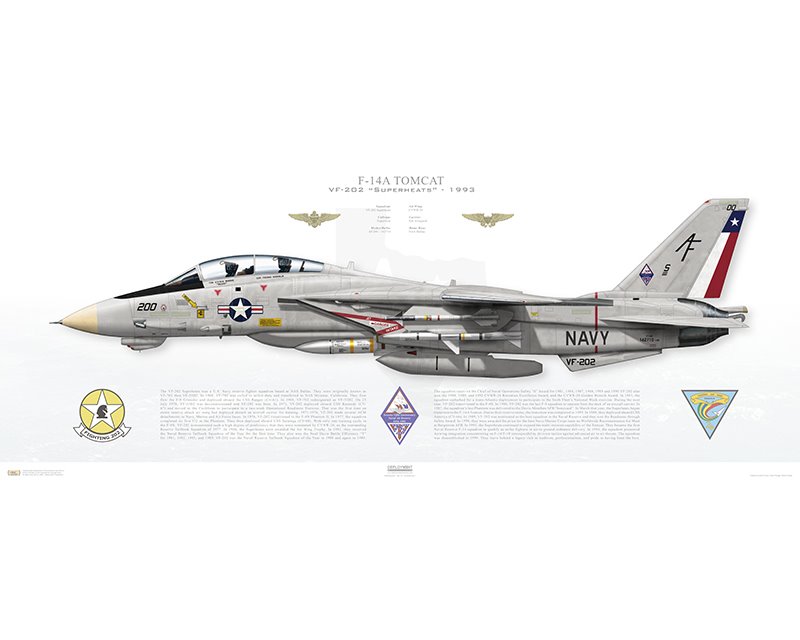
Locate an element on the screen. The width and height of the screenshot is (800, 640). window is located at coordinates (230, 260), (297, 264).